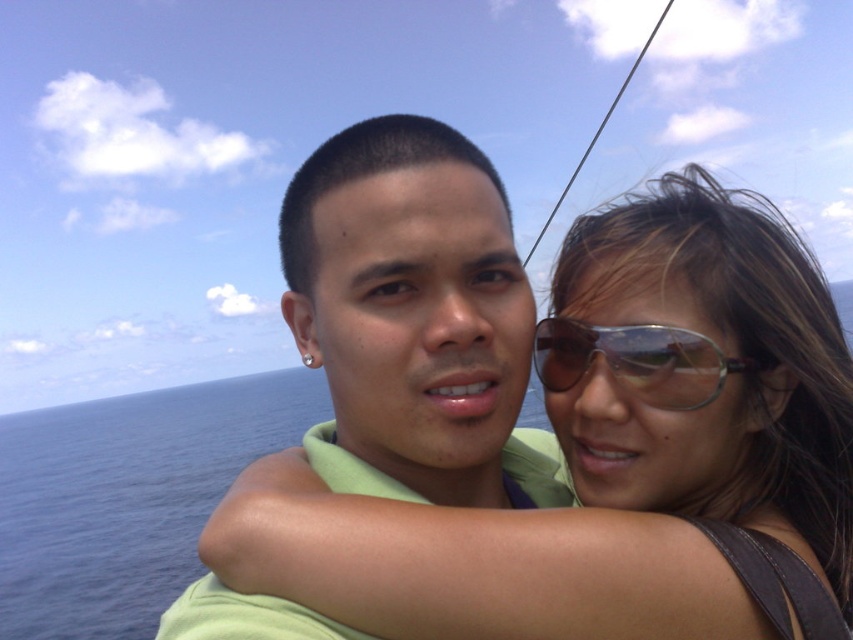
Is point (566, 492) in front of point (630, 380)?

No, it is behind (630, 380).

This screenshot has width=853, height=640. I want to click on matte green shirt at center, so click(413, 317).

Locate an element on the screen. The height and width of the screenshot is (640, 853). matte green shirt at center is located at coordinates (413, 317).